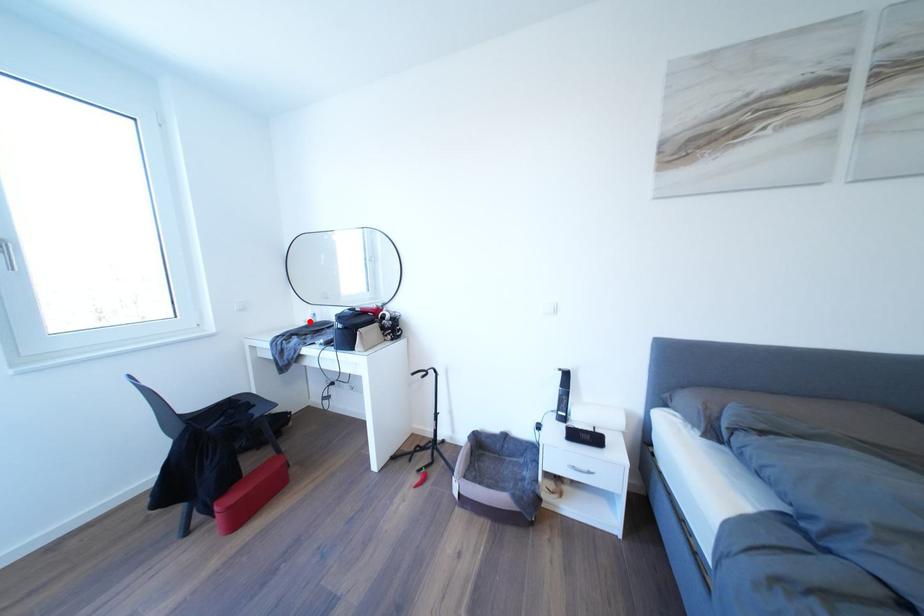
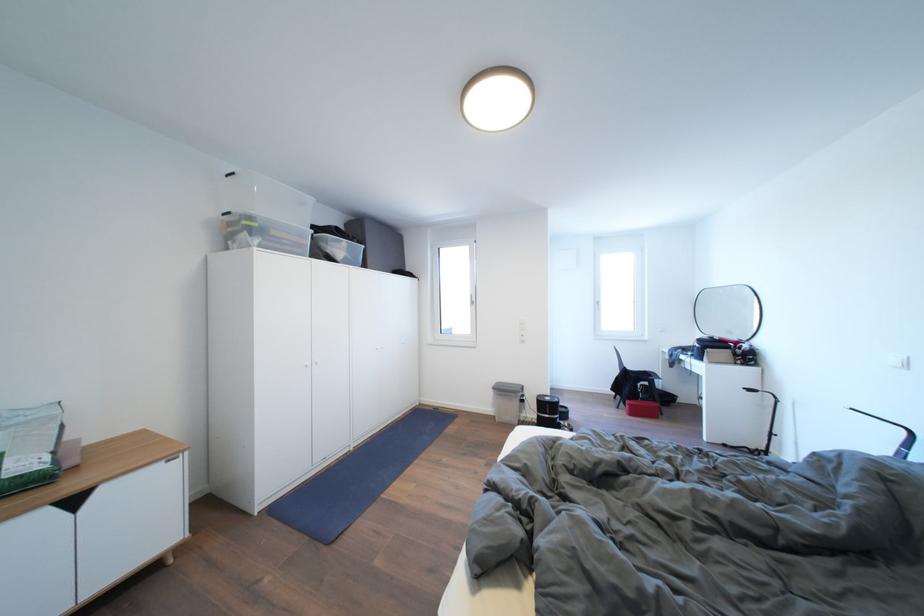
Question: I am providing you with two images of the same scene from different viewpoints. A red point is marked on the first image. Can you still see the location of the red point in image 2?

Choices:
 (A) Yes
 (B) No

Answer: (B)